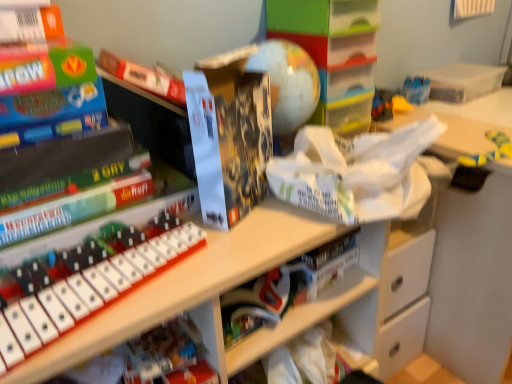
Image resolution: width=512 pixels, height=384 pixels. Identify the location of white plastic musical keyboard at center. (90, 291).

What do you see at coordinates (285, 287) in the screenshot? The image size is (512, 384). I see `white matte book at center` at bounding box center [285, 287].

In order to face yellow rubber boot at right, should I rotate leftwards or rightwards?

To face it directly, rotate right by 31.972 degrees.

The image size is (512, 384). I want to click on clear plastic box at upper right, so click(x=464, y=81).

The height and width of the screenshot is (384, 512). Identify the location of white matte keyboard at center, which is the first shelf from bottom to top. (187, 283).

Which point is more distant from viewer, (465,66) or (255,204)?

The point (465,66) is farther.

From a real-world perspective, who is located lower, clear plastic box at upper right or matte black lego box at center?

clear plastic box at upper right, from a real-world perspective.

Can you see clear plastic box at upper right touching matte black lego box at center?

clear plastic box at upper right and matte black lego box at center are not in contact.

From the image's perspective, does clear plastic box at upper right appear higher than matte black lego box at center?

Yes.

Is yellow rubber boot at right surrounded by white matte book at center?

No, white matte book at center does not contain yellow rubber boot at right.

Who is bigger, white matte book at center or yellow rubber boot at right?

white matte book at center is bigger.

From the image's perspective, is white matte book at center over yellow rubber boot at right?

No, from the image's perspective, white matte book at center is not above yellow rubber boot at right.

Is white matte book at center positioned behind white plastic musical keyboard at center?

Yes, white matte book at center is behind white plastic musical keyboard at center.

Would you consider white matte book at center to be distant from white plastic musical keyboard at center?

Actually, white matte book at center and white plastic musical keyboard at center are a little close together.

Can white plastic musical keyboard at center be found inside white matte book at center?

That's incorrect, white plastic musical keyboard at center is not inside white matte book at center.

Which is more to the left, white matte book at center or white plastic musical keyboard at center?

white plastic musical keyboard at center.

Is white matte book at center at the back of matte black lego box at center?

No, matte black lego box at center's orientation is not away from white matte book at center.

From the image's perspective, is matte black lego box at center above white matte book at center?

Yes.

Considering the sizes of matte black lego box at center and white matte book at center in the image, is matte black lego box at center wider or thinner than white matte book at center?

Considering their sizes, matte black lego box at center looks slimmer than white matte book at center.

Is point (124, 293) in front of point (504, 72)?

Yes.

Can you tell me how much white plastic musical keyboard at center and clear plastic box at upper right differ in facing direction?

9.75 degrees.

The height and width of the screenshot is (384, 512). There is a white plastic musical keyboard at center. Identify the location of box above it (from a real-world perspective). (464, 81).

Could you tell me if white plastic musical keyboard at center is facing clear plastic box at upper right?

No, white plastic musical keyboard at center does not turn towards clear plastic box at upper right.

Is matte plastic globe at center, positioned as the second shelf in bottom-to-top order, wider or thinner than clear plastic box at upper right?

Clearly, matte plastic globe at center, positioned as the second shelf in bottom-to-top order, has more width compared to clear plastic box at upper right.

Is matte plastic globe at center, placed as the first shelf when sorted from top to bottom, inside or outside of clear plastic box at upper right?

matte plastic globe at center, placed as the first shelf when sorted from top to bottom, exists outside the volume of clear plastic box at upper right.

Looking at the image, does matte plastic globe at center, placed as the first shelf when sorted from top to bottom, seem bigger or smaller compared to clear plastic box at upper right?

matte plastic globe at center, placed as the first shelf when sorted from top to bottom, is bigger than clear plastic box at upper right.

From a real-world perspective, does matte plastic globe at center, placed as the first shelf when sorted from top to bottom, sit lower than clear plastic box at upper right?

No, from a real-world perspective, matte plastic globe at center, placed as the first shelf when sorted from top to bottom, is not below clear plastic box at upper right.

Considering the points (487, 83) and (498, 131), which point is in front, point (487, 83) or point (498, 131)?

The point (498, 131) is closer to the camera.

Is clear plastic box at upper right far from yellow rubber boot at right?

They are positioned close to each other.

Which of these two, clear plastic box at upper right or yellow rubber boot at right, is smaller?

With smaller size is yellow rubber boot at right.

In the image, is clear plastic box at upper right positioned in front of or behind yellow rubber boot at right?

Visually, clear plastic box at upper right is located behind yellow rubber boot at right.

Find the location of a particular element. The height and width of the screenshot is (384, 512). paperback book below the clear plastic box at upper right (from the image's perspective) is located at coordinates (229, 135).

The width and height of the screenshot is (512, 384). I want to click on toy behind the white matte book at center, so click(490, 151).

When comparing their distances from white plastic musical keyboard at center, does matte black lego box at center or yellow rubber boot at right seem closer?

The object closer to white plastic musical keyboard at center is matte black lego box at center.

Looking at the image, which one is located closer to white plastic musical keyboard at center, white matte book at center or matte black lego box at center?

Based on the image, matte black lego box at center appears to be nearer to white plastic musical keyboard at center.

Based on their spatial positions, is white plastic musical keyboard at center or white matte keyboard at center, which is the first shelf from bottom to top, closer to yellow rubber boot at right?

white matte keyboard at center, which is the first shelf from bottom to top.

Considering their positions, is matte plastic globe at center, positioned as the second shelf in bottom-to-top order, positioned further to white matte keyboard at center, which is the first shelf from bottom to top, than yellow rubber boot at right?

Among the two, yellow rubber boot at right is located further to white matte keyboard at center, which is the first shelf from bottom to top.

Based on their spatial positions, is white matte book at center or matte plastic globe at center, positioned as the second shelf in bottom-to-top order, closer to white matte keyboard at center, which is the 2th shelf in top-to-bottom order?

white matte book at center lies closer to white matte keyboard at center, which is the 2th shelf in top-to-bottom order, than the other object.

Which object lies further to the anchor point clear plastic box at upper right, yellow rubber boot at right or matte plastic globe at center, positioned as the second shelf in bottom-to-top order?

Based on the image, matte plastic globe at center, positioned as the second shelf in bottom-to-top order, appears to be further to clear plastic box at upper right.

Looking at the image, which one is located closer to matte black lego box at center, white matte keyboard at center, which is the 2th shelf in top-to-bottom order, or white plastic musical keyboard at center?

white matte keyboard at center, which is the 2th shelf in top-to-bottom order, is positioned closer to the anchor matte black lego box at center.

Based on their spatial positions, is white matte book at center or clear plastic box at upper right closer to matte plastic globe at center, placed as the first shelf when sorted from top to bottom?

The object closer to matte plastic globe at center, placed as the first shelf when sorted from top to bottom, is white matte book at center.

Find the location of a particular element. The height and width of the screenshot is (384, 512). paperback book situated between white plastic musical keyboard at center and clear plastic box at upper right from left to right is located at coordinates (229, 135).

What are the coordinates of `musical keyboard positioned between white matte keyboard at center, which is the 2th shelf in top-to-bottom order, and white matte book at center from near to far` in the screenshot? It's located at (90, 291).

Locate an element on the screen. Image resolution: width=512 pixels, height=384 pixels. paperback book between white matte keyboard at center, which is the first shelf from bottom to top, and yellow rubber boot at right from left to right is located at coordinates (229, 135).

Find the location of `musical keyboard between matte plastic globe at center, placed as the first shelf when sorted from top to bottom, and white matte keyboard at center, which is the 2th shelf in top-to-bottom order, vertically`. musical keyboard between matte plastic globe at center, placed as the first shelf when sorted from top to bottom, and white matte keyboard at center, which is the 2th shelf in top-to-bottom order, vertically is located at coordinates (90, 291).